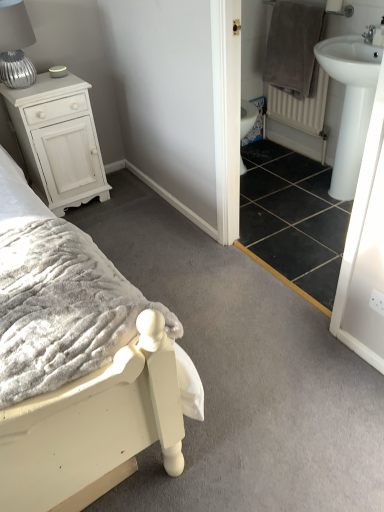
The height and width of the screenshot is (512, 384). I want to click on free location to the right of white textured bed at center, so click(x=237, y=340).